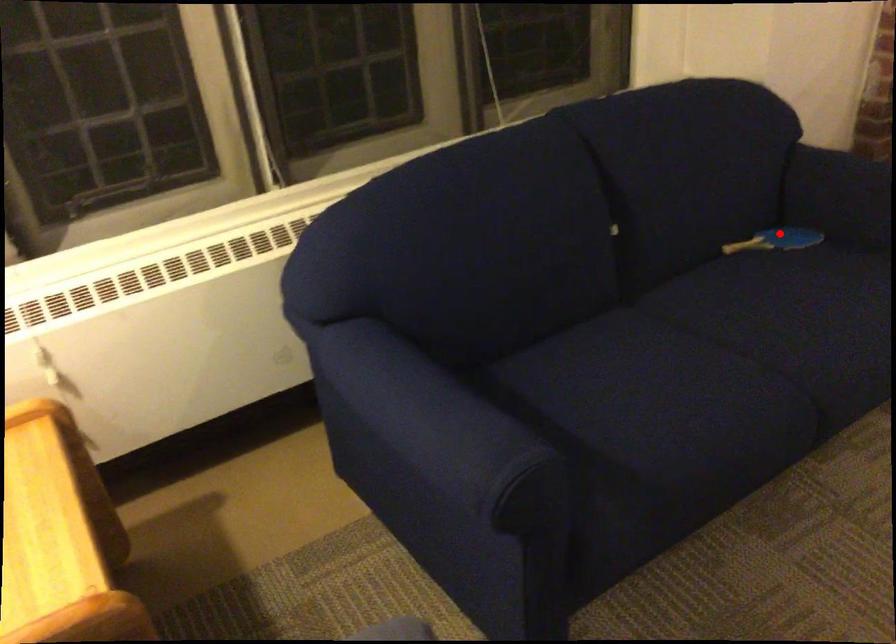
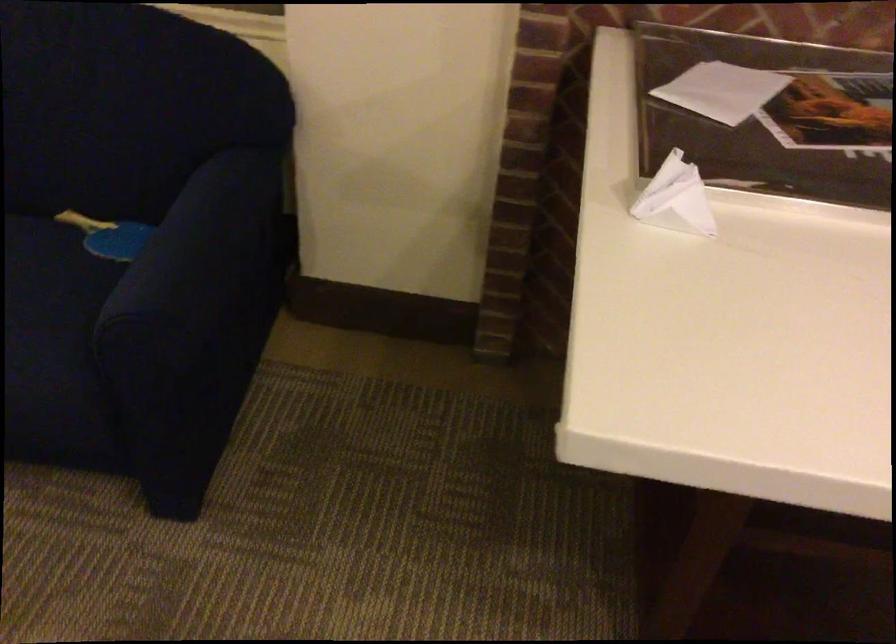
Find the pixel in the second image that matches the highlighted location in the first image.

(108, 236)